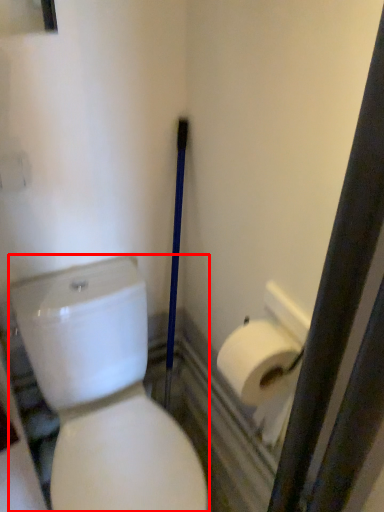
Question: In this image, where is porcelain (annotated by the red box) located relative to toilet paper?

Choices:
 (A) left
 (B) right

Answer: (A)